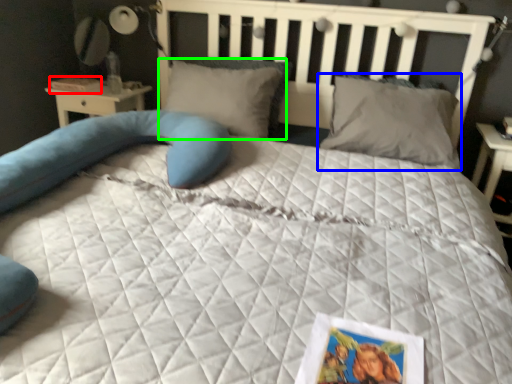
Question: Which object is the farthest from book (highlighted by a red box)? Choose among these: pillow (highlighted by a blue box) or pillow (highlighted by a green box).

Choices:
 (A) pillow
 (B) pillow

Answer: (A)